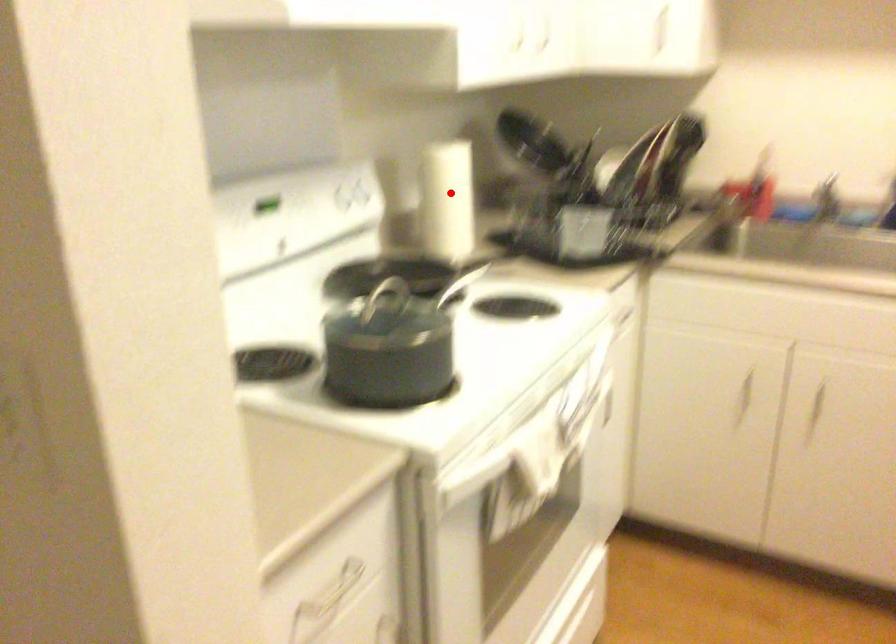
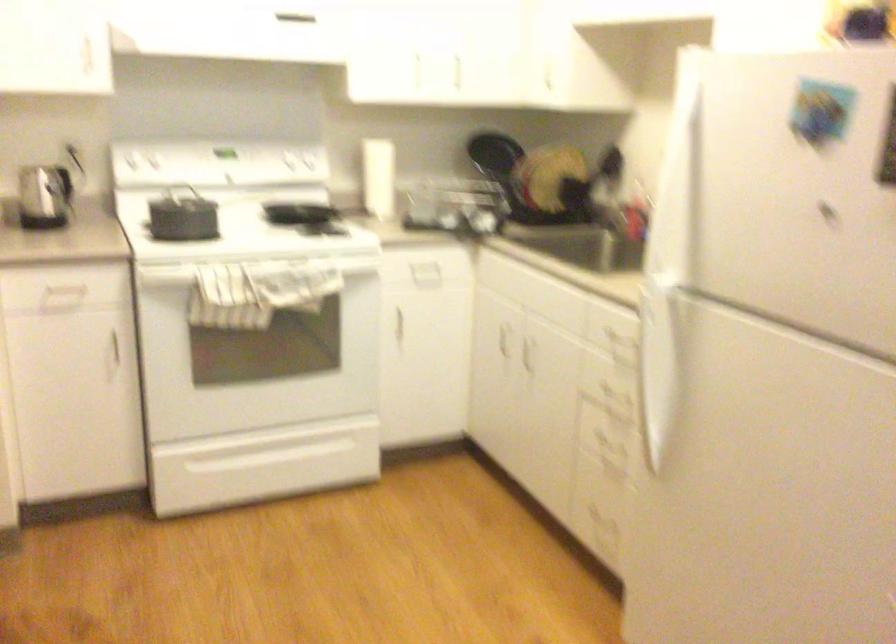
Question: I am providing you with two images of the same scene from different viewpoints. Image1 has a red point marked. In image2, the corresponding 3D location appears at what relative position? Reply with the corresponding letter.

Choices:
 (A) Closer
 (B) Farther

Answer: (B)